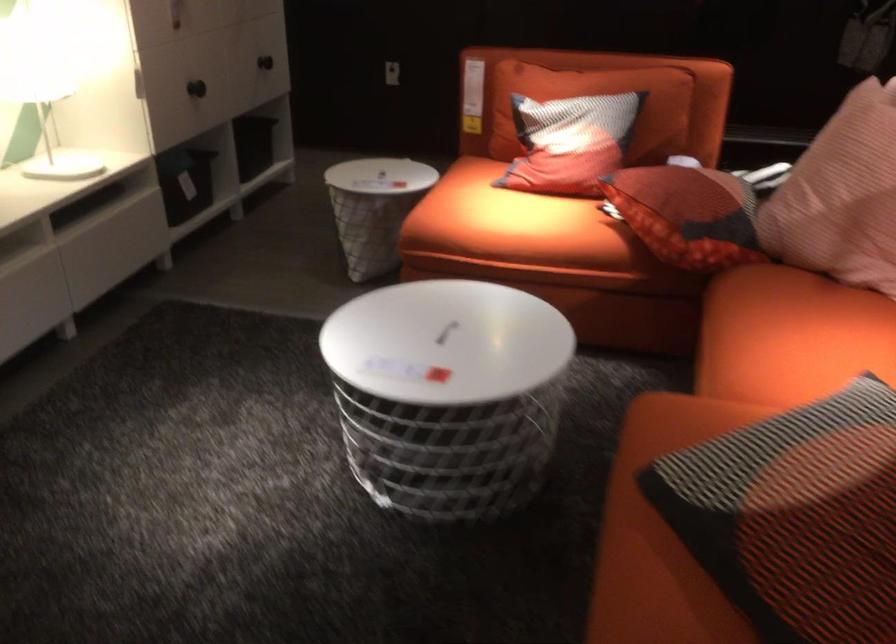
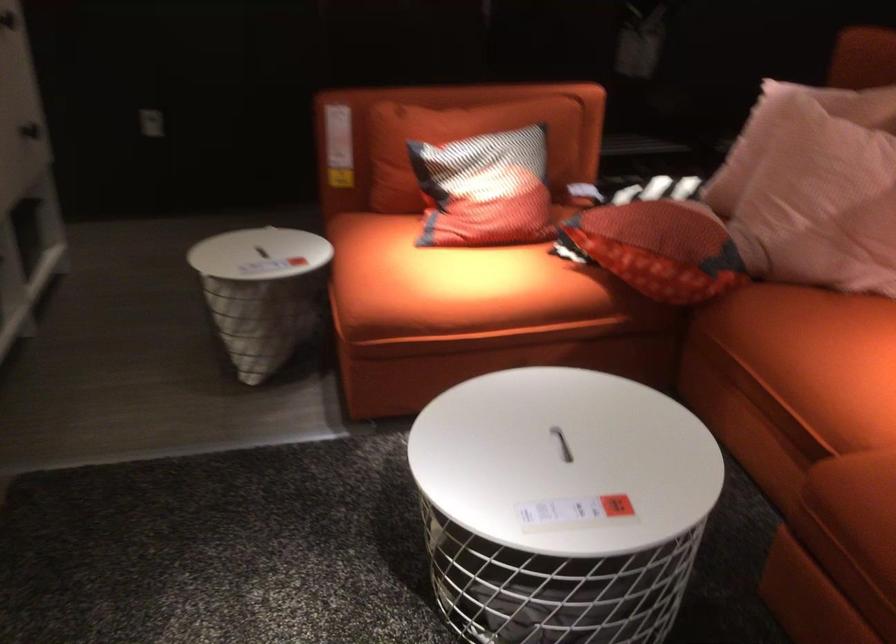
Question: Based on the continuous images, in which direction is the camera rotating? Reply with the corresponding letter.

Choices:
 (A) Left
 (B) Right
 (C) Up
 (D) Down

Answer: (B)